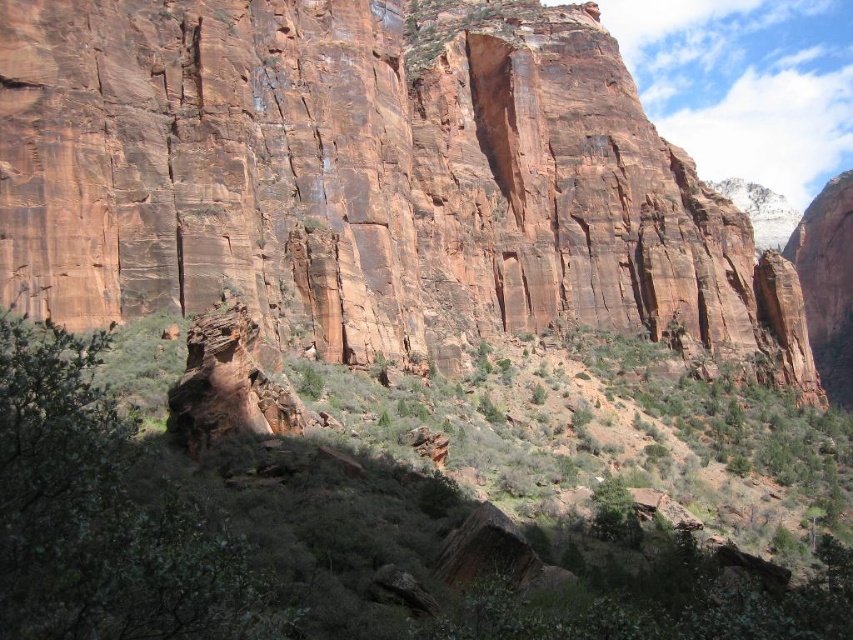
Question: Can you confirm if reddish-brown rock face at center is positioned above green leafy shrubs at center?

Choices:
 (A) no
 (B) yes

Answer: (B)

Question: Which point is farther to the camera?

Choices:
 (A) reddish-brown rock face at center
 (B) green leafy shrubs at center

Answer: (A)

Question: Does reddish-brown rock face at center have a smaller size compared to green leafy shrubs at center?

Choices:
 (A) yes
 (B) no

Answer: (B)

Question: Is reddish-brown rock face at center below green leafy shrubs at center?

Choices:
 (A) no
 (B) yes

Answer: (A)

Question: Which object appears farthest from the camera in this image?

Choices:
 (A) green leafy shrubs at center
 (B) reddish-brown rock face at center

Answer: (B)